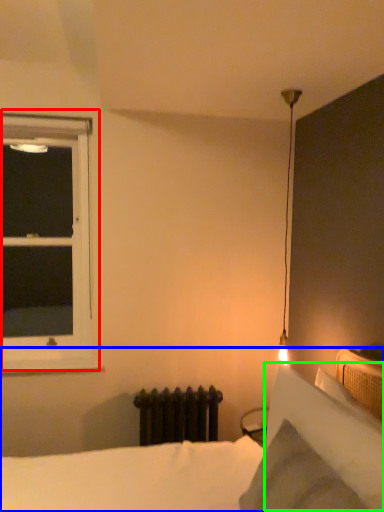
Question: Which is farther away from window (highlighted by a red box)? bed (highlighted by a blue box) or pillow (highlighted by a green box)?

Choices:
 (A) bed
 (B) pillow

Answer: (B)